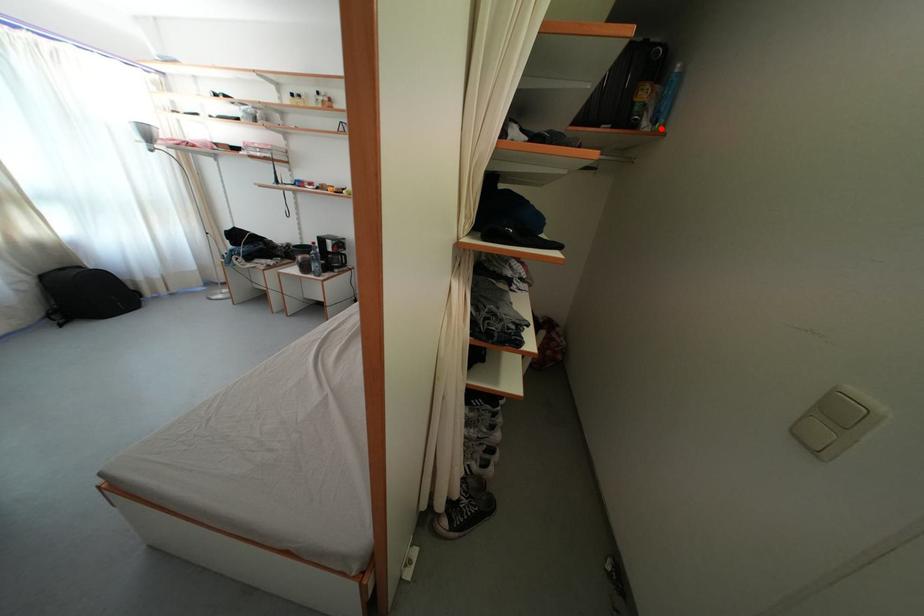
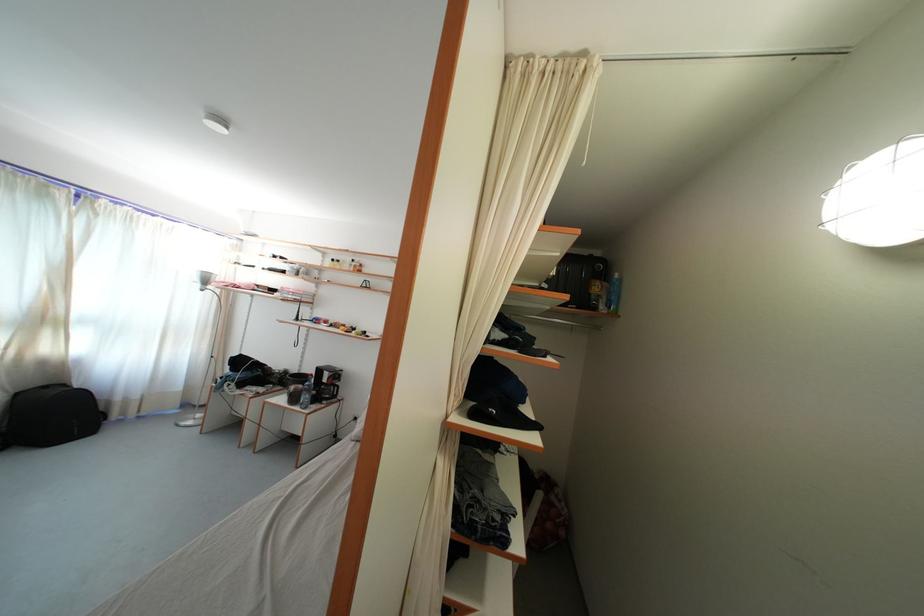
In the second image, find the point that corresponds to the highlighted location in the first image.

(615, 314)